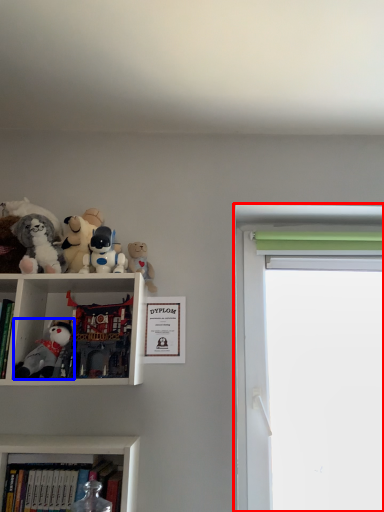
Question: Among these objects, which one is farthest to the camera, window screen (highlighted by a red box) or toy (highlighted by a blue box)?

Choices:
 (A) window screen
 (B) toy

Answer: (A)